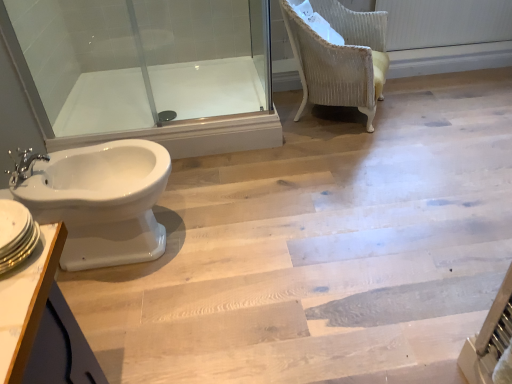
Question: Is white glossy bidet at left oriented towards chrome metallic faucet at left?

Choices:
 (A) no
 (B) yes

Answer: (A)

Question: Is white glossy bidet at left at the right side of chrome metallic faucet at left?

Choices:
 (A) no
 (B) yes

Answer: (B)

Question: From the image's perspective, is white glossy bidet at left over chrome metallic faucet at left?

Choices:
 (A) no
 (B) yes

Answer: (A)

Question: Considering the relative sizes of white glossy bidet at left and chrome metallic faucet at left in the image provided, is white glossy bidet at left thinner than chrome metallic faucet at left?

Choices:
 (A) yes
 (B) no

Answer: (B)

Question: Is white glossy bidet at left closer to camera compared to chrome metallic faucet at left?

Choices:
 (A) no
 (B) yes

Answer: (B)

Question: Can you confirm if white glossy bidet at left is smaller than chrome metallic faucet at left?

Choices:
 (A) yes
 (B) no

Answer: (B)

Question: Can you confirm if chrome metallic faucet at left is positioned to the right of velvet yellow chair at upper right?

Choices:
 (A) yes
 (B) no

Answer: (B)

Question: Is chrome metallic faucet at left wider than velvet yellow chair at upper right?

Choices:
 (A) yes
 (B) no

Answer: (B)

Question: Would you say velvet yellow chair at upper right is part of chrome metallic faucet at left's contents?

Choices:
 (A) no
 (B) yes

Answer: (A)

Question: Is chrome metallic faucet at left next to velvet yellow chair at upper right?

Choices:
 (A) no
 (B) yes

Answer: (A)

Question: Does chrome metallic faucet at left have a larger size compared to velvet yellow chair at upper right?

Choices:
 (A) no
 (B) yes

Answer: (A)

Question: From the image's perspective, does chrome metallic faucet at left appear lower than velvet yellow chair at upper right?

Choices:
 (A) yes
 (B) no

Answer: (A)

Question: From the image's perspective, is white glossy bidet at left on top of white glossy bidet at lower left?

Choices:
 (A) no
 (B) yes

Answer: (B)